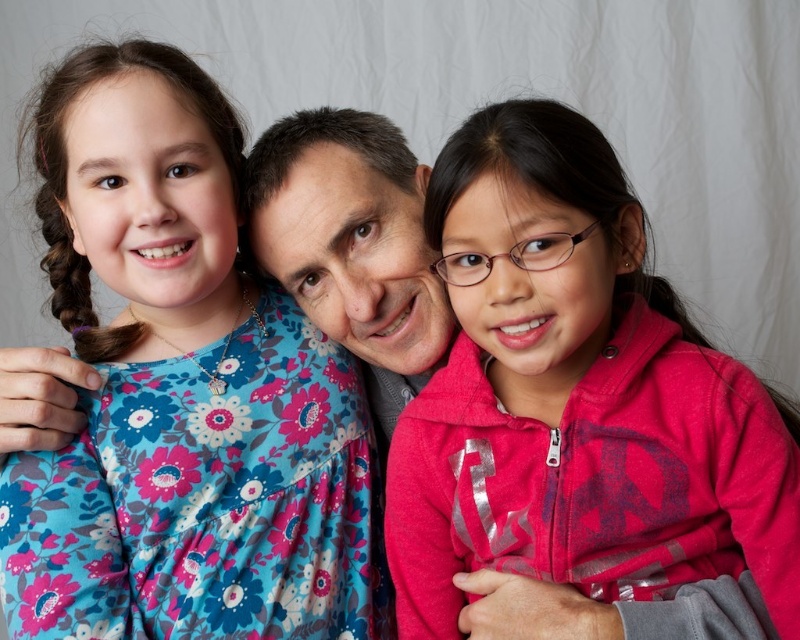
Between floral fabric dress at upper left and pink fleece jacket at center, which one appears on the right side from the viewer's perspective?

Positioned to the right is pink fleece jacket at center.

Which is in front, point (376, 624) or point (654, 570)?

Point (654, 570) is more forward.

I want to click on floral fabric dress at upper left, so click(x=182, y=392).

Where is `floral fabric dress at upper left`? The height and width of the screenshot is (640, 800). floral fabric dress at upper left is located at coordinates (182, 392).